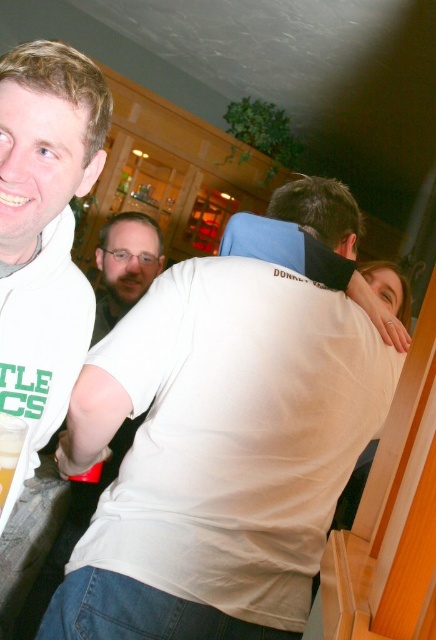
Question: Which of the following is the closest to the observer?

Choices:
 (A) (47, 204)
 (B) (17, 451)

Answer: (B)

Question: Which of the following is the farthest from the observer?

Choices:
 (A) translucent glass beer at lower left
 (B) white matte t-shirt at left

Answer: (B)

Question: Does white matte t-shirt at left have a lesser width compared to translucent glass beer at lower left?

Choices:
 (A) yes
 (B) no

Answer: (B)

Question: Can you confirm if white matte t-shirt at left is smaller than translucent glass beer at lower left?

Choices:
 (A) yes
 (B) no

Answer: (B)

Question: Is white matte t-shirt at left further to camera compared to translucent glass beer at lower left?

Choices:
 (A) yes
 (B) no

Answer: (A)